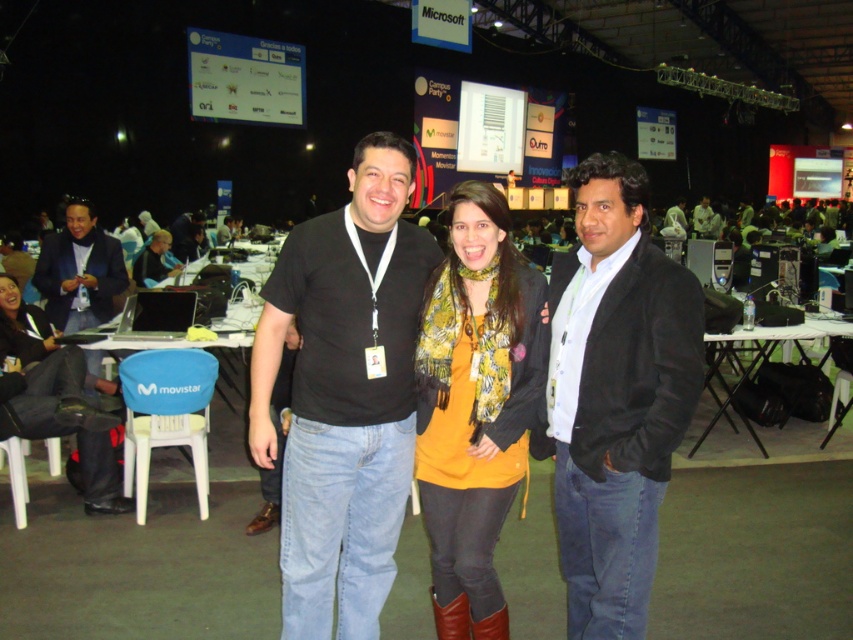
Which of these two, black cotton jacket at center or light brown leather jacket at center, stands shorter?

Standing shorter between the two is light brown leather jacket at center.

Is point (585, 548) in front of point (698, 227)?

Yes, point (585, 548) is closer to viewer.

Locate an element on the screen. The image size is (853, 640). black cotton jacket at center is located at coordinates (616, 396).

Which is more to the left, black matte t-shirt at center or light brown leather jacket at center?

black matte t-shirt at center is more to the left.

Which is in front, point (431, 269) or point (703, 211)?

Point (431, 269) is in front.

Find the location of a particular element. This screenshot has height=640, width=853. black matte t-shirt at center is located at coordinates (344, 394).

Which is in front, point (705, 205) or point (682, 202)?

Point (705, 205) is in front.

Looking at this image, which is more to the left, light brown leather jacket at center or matte black jacket at center?

Positioned to the left is matte black jacket at center.

Image resolution: width=853 pixels, height=640 pixels. What are the coordinates of `light brown leather jacket at center` in the screenshot? It's located at (704, 220).

The image size is (853, 640). Identify the location of light brown leather jacket at center. (704, 220).